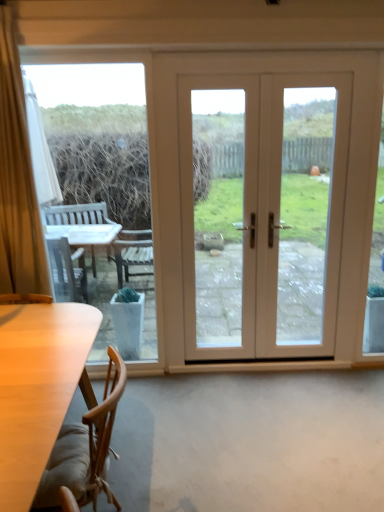
Question: Considering the relative sizes of white glossy door at center and transparent glass table at left in the image provided, is white glossy door at center bigger than transparent glass table at left?

Choices:
 (A) no
 (B) yes

Answer: (B)

Question: Is white glossy door at center far away from transparent glass table at left?

Choices:
 (A) no
 (B) yes

Answer: (B)

Question: Is the depth of white glossy door at center less than that of transparent glass table at left?

Choices:
 (A) no
 (B) yes

Answer: (A)

Question: Is white glossy door at center positioned beyond the bounds of transparent glass table at left?

Choices:
 (A) no
 (B) yes

Answer: (B)

Question: Does white glossy door at center have a lesser width compared to transparent glass table at left?

Choices:
 (A) no
 (B) yes

Answer: (A)

Question: From their relative heights in the image, would you say transparent glass table at left is taller or shorter than wooden chair at lower left?

Choices:
 (A) short
 (B) tall

Answer: (B)

Question: From a real-world perspective, is transparent glass table at left above or below wooden chair at lower left?

Choices:
 (A) above
 (B) below

Answer: (A)

Question: Does point (109, 135) appear closer or farther from the camera than point (72, 478)?

Choices:
 (A) closer
 (B) farther

Answer: (B)

Question: Would you say transparent glass table at left is inside or outside wooden chair at lower left?

Choices:
 (A) inside
 (B) outside

Answer: (B)

Question: In terms of height, does white glossy door at center look taller or shorter compared to transparent glass table at left?

Choices:
 (A) tall
 (B) short

Answer: (B)

Question: Choose the correct answer: Is white glossy door at center inside transparent glass table at left or outside it?

Choices:
 (A) outside
 (B) inside

Answer: (A)

Question: Does point click(x=254, y=309) appear closer or farther from the camera than point click(x=152, y=261)?

Choices:
 (A) farther
 (B) closer

Answer: (A)

Question: Would you say white glossy door at center is to the left or to the right of transparent glass table at left in the picture?

Choices:
 (A) right
 (B) left

Answer: (A)

Question: Considering the positions of white glossy door at center and wooden chair at lower left in the image, is white glossy door at center bigger or smaller than wooden chair at lower left?

Choices:
 (A) big
 (B) small

Answer: (A)

Question: From their relative heights in the image, would you say white glossy door at center is taller or shorter than wooden chair at lower left?

Choices:
 (A) short
 (B) tall

Answer: (B)